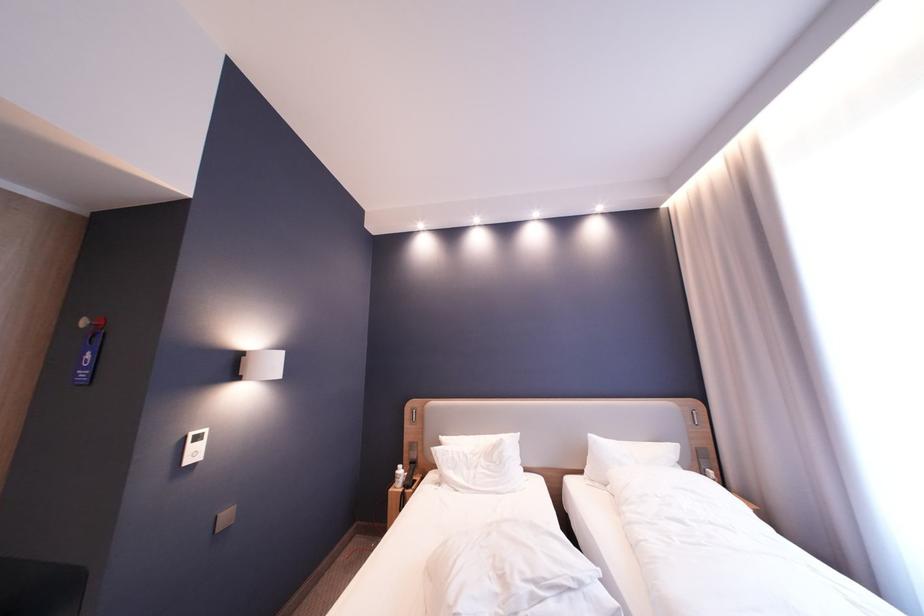
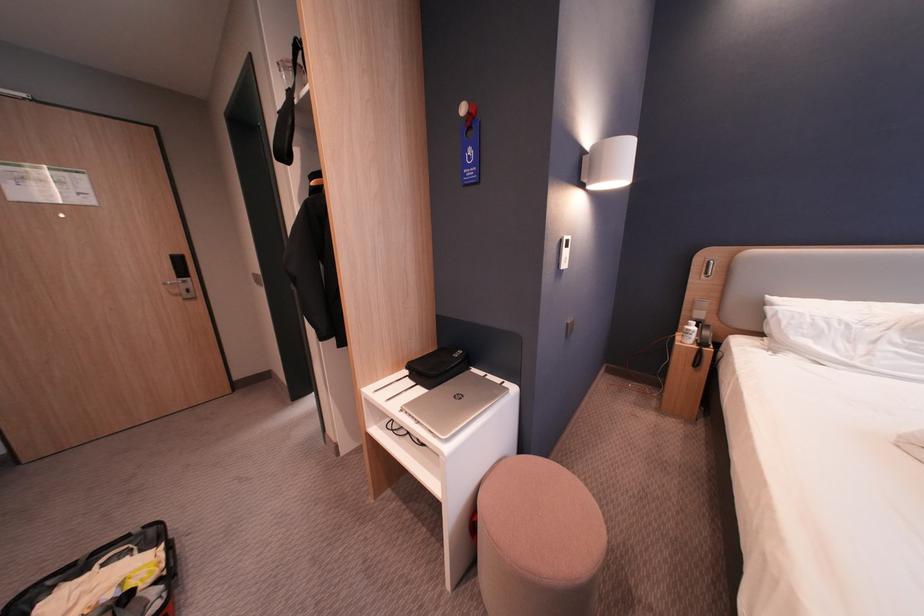
In the second image, find the point that corresponds to [193,437] in the first image.

(569, 240)